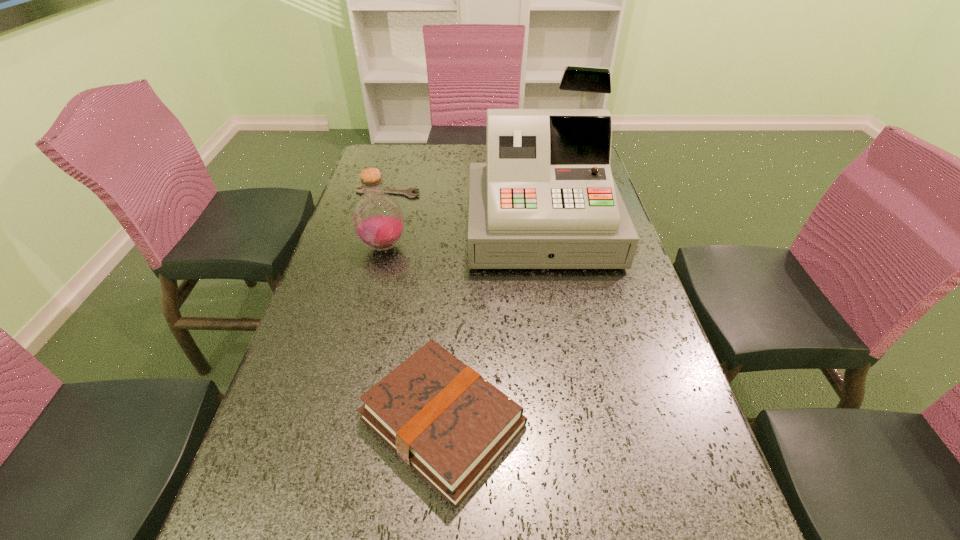
Find the location of `free space between the shortest object and the third tallest object`. free space between the shortest object and the third tallest object is located at coordinates (416, 307).

Find the location of a particular element. free space between the second tallest object and the tallest object is located at coordinates [463, 237].

Identify the location of vacant area between the shortest object and the tallest object. (465, 210).

Select which object appears as the second closest to the hardback book. Please provide its 2D coordinates. Your answer should be formatted as a tuple, i.e. [(x, y)], where the tuple contains the x and y coordinates of a point satisfying the conditions above.

[(378, 220)]

I want to click on object that stands as the third closest to the cash register, so (447, 422).

The image size is (960, 540). I want to click on vacant space that satisfies the following two spatial constraints: 1. on the front side of the wrench; 2. on the right side of the bottle, so click(372, 246).